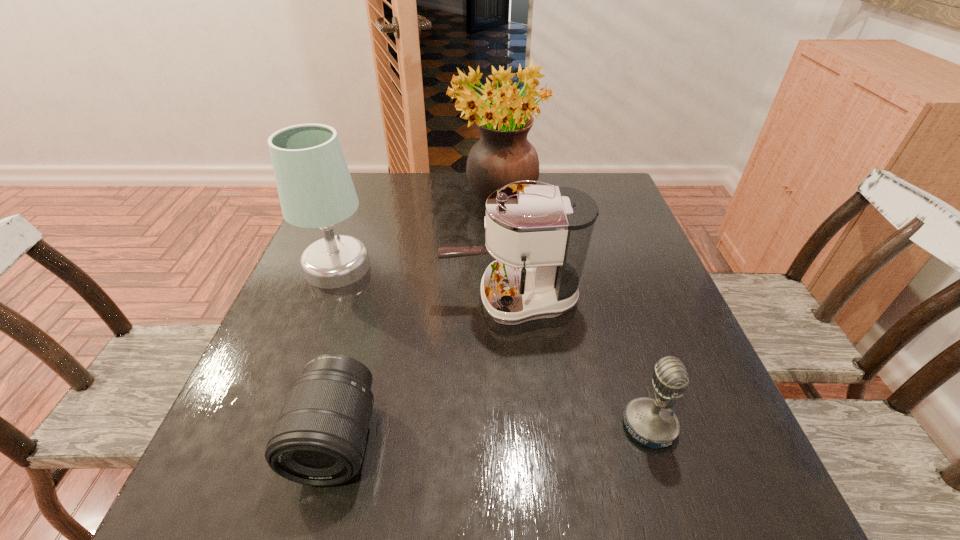
The height and width of the screenshot is (540, 960). Find the location of `vacant space located 0.110m on the front-facing side of the coffee maker`. vacant space located 0.110m on the front-facing side of the coffee maker is located at coordinates point(392,299).

You are a GUI agent. You are given a task and a screenshot of the screen. Output one action in this format:
    pyautogui.click(x=<x>, y=<y>)
    Task: Click on the free space located 0.310m on the front-facing side of the rightmost object
    This screenshot has height=540, width=960.
    Given the screenshot: What is the action you would take?
    pyautogui.click(x=439, y=426)

The height and width of the screenshot is (540, 960). Identify the location of vacant space situated 0.200m on the front-facing side of the rightmost object. (504, 426).

Where is `free location located on the front-facing side of the rightmost object`? free location located on the front-facing side of the rightmost object is located at coordinates (444, 426).

What are the coordinates of `object that is at the far edge` in the screenshot? It's located at (503, 155).

The width and height of the screenshot is (960, 540). I want to click on object present at the near edge, so click(x=319, y=439).

Locate an element on the screen. Image resolution: width=960 pixels, height=540 pixels. lampshade positioned at the left edge is located at coordinates [x=315, y=188].

You are a GUI agent. You are given a task and a screenshot of the screen. Output one action in this format:
    pyautogui.click(x=<x>, y=<y>)
    Task: Click on the telephoto lens located at the left edge
    Image resolution: width=960 pixels, height=540 pixels.
    Given the screenshot: What is the action you would take?
    pyautogui.click(x=319, y=439)

What are the coordinates of `object present at the right edge` in the screenshot? It's located at (652, 423).

In order to click on object that is at the near left corner in this screenshot , I will do `click(319, 439)`.